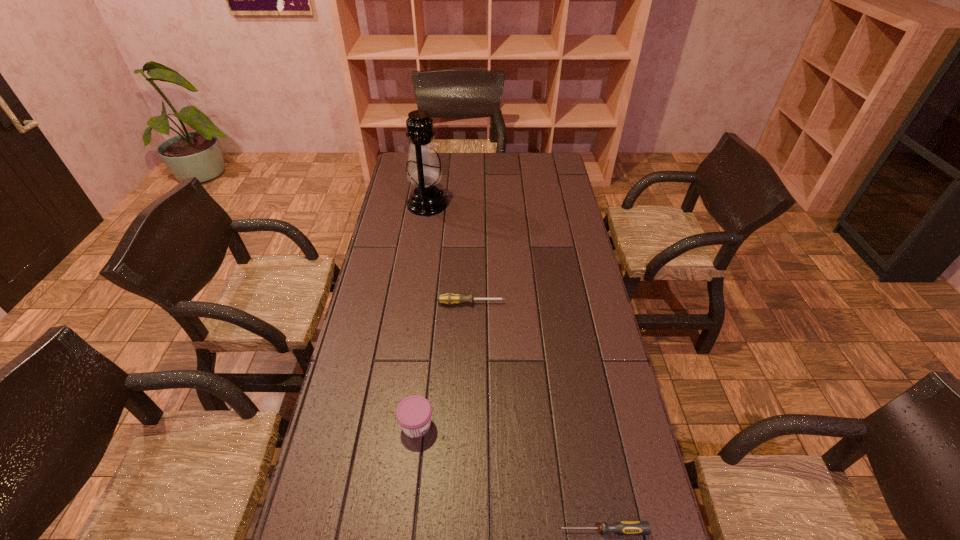
Where is `vacant space that is in between the nearer screwdriver and the farther screwdriver`? vacant space that is in between the nearer screwdriver and the farther screwdriver is located at coordinates (538, 417).

This screenshot has height=540, width=960. What are the coordinates of `free point between the jam and the shorter screwdriver` in the screenshot? It's located at (510, 477).

The image size is (960, 540). Find the location of `free space between the rightmost object and the farthest object`. free space between the rightmost object and the farthest object is located at coordinates (516, 367).

The width and height of the screenshot is (960, 540). Identify the location of empty space that is in between the farthest object and the left screwdriver. (449, 254).

What are the coordinates of `vacant space that's between the oil lamp and the nearer screwdriver` in the screenshot? It's located at (516, 367).

At what (x,y) coordinates should I click in order to perform the action: click on free point between the second nearest object and the nearer screwdriver. Please return your answer as a coordinate pair (x, y). Looking at the image, I should click on (510, 477).

Where is `vacant region between the farthest object and the shorter screwdriver`? vacant region between the farthest object and the shorter screwdriver is located at coordinates (516, 367).

At what (x,y) coordinates should I click in order to perform the action: click on free space between the second tallest object and the third nearest object. Please return your answer as a coordinate pair (x, y). This screenshot has width=960, height=540. Looking at the image, I should click on (444, 364).

You are a GUI agent. You are given a task and a screenshot of the screen. Output one action in this format:
    pyautogui.click(x=<x>, y=<y>)
    Task: Click on the free space between the second nearest object and the oil lamp
    
    Given the screenshot: What is the action you would take?
    pyautogui.click(x=421, y=315)

You are a GUI agent. You are given a task and a screenshot of the screen. Output one action in this format:
    pyautogui.click(x=<x>, y=<y>)
    Task: Click on the closest object relative to the tallest object
    The width and height of the screenshot is (960, 540).
    Given the screenshot: What is the action you would take?
    coord(449,298)